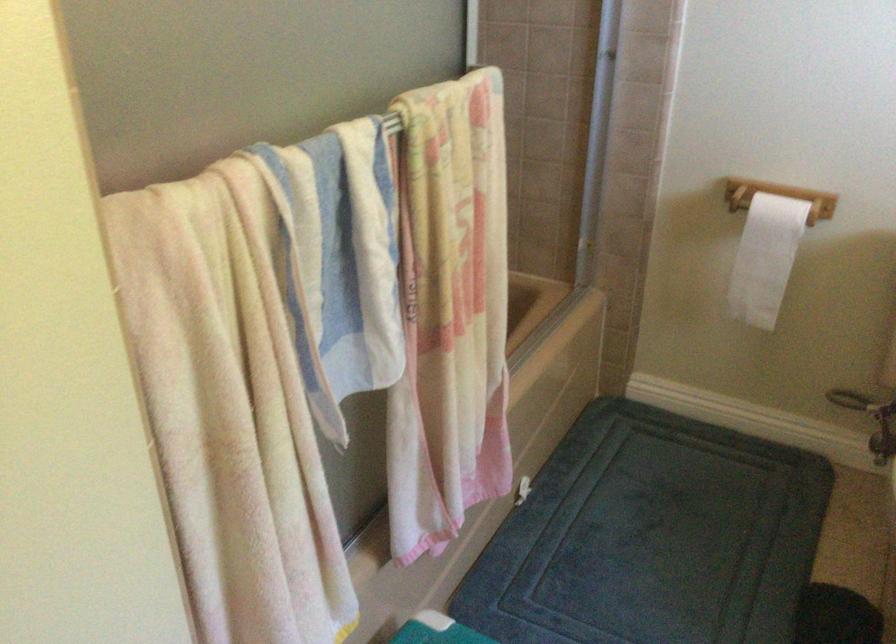
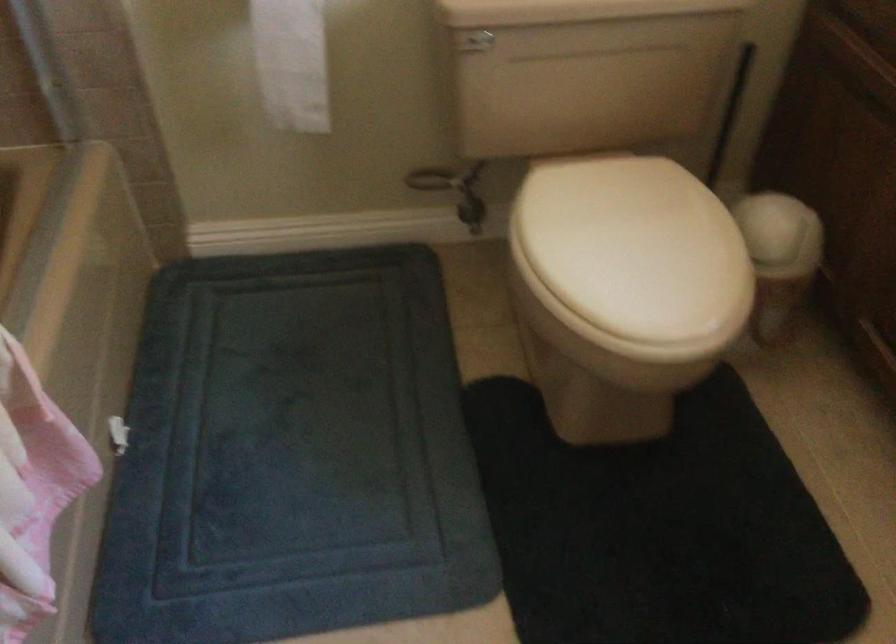
Where in the second image is the point corresponding to point 762,265 from the first image?

(291, 62)